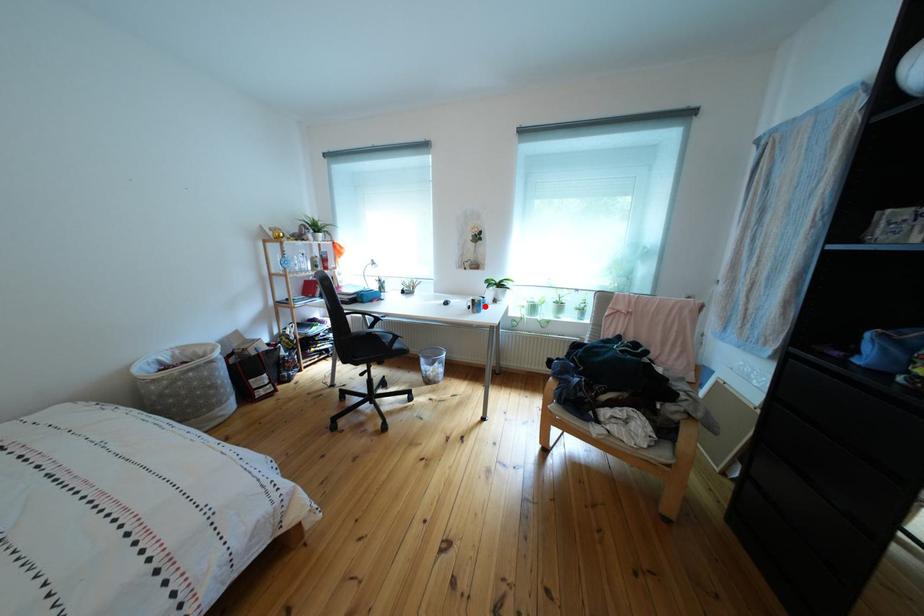
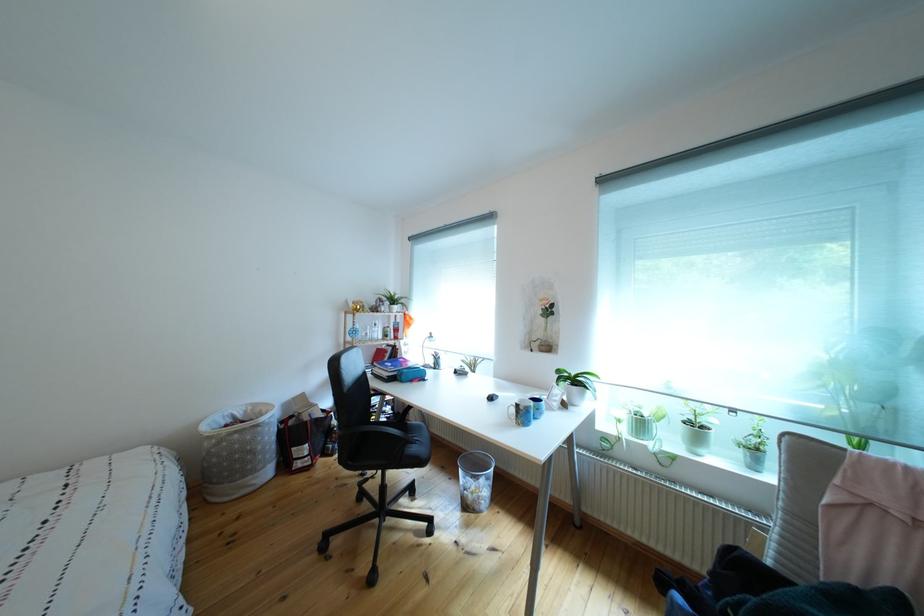
In the second image, find the point that corresponds to the highlighted location in the first image.

(529, 411)